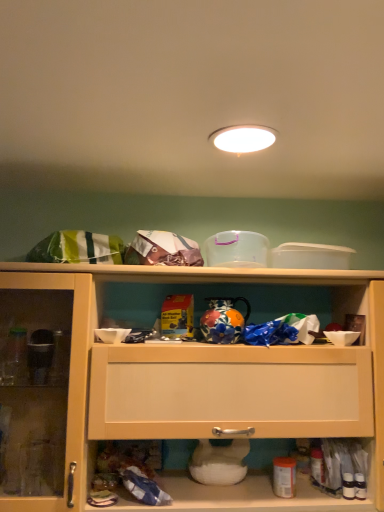
I want to click on matte wood cabinet at center, so click(x=165, y=379).

Describe the element at coordinates (165, 379) in the screenshot. The width and height of the screenshot is (384, 512). I see `matte wood cabinet at center` at that location.

Measure the distance between matte wood cabinet at center and camera.

A distance of 1.25 meters exists between matte wood cabinet at center and camera.

You are a GUI agent. You are given a task and a screenshot of the screen. Output one action in this format:
    pyautogui.click(x=<x>, y=<y>)
    Task: Click on the white glossy light fixture at upper center
    This screenshot has width=384, height=512.
    Given the screenshot: What is the action you would take?
    pyautogui.click(x=243, y=138)

The image size is (384, 512). What do you see at coordinates (243, 138) in the screenshot?
I see `white glossy light fixture at upper center` at bounding box center [243, 138].

Where is `matte wood cabinet at center`? matte wood cabinet at center is located at coordinates (165, 379).

Does white glossy light fixture at upper center appear on the right side of matte wood cabinet at center?

Correct, you'll find white glossy light fixture at upper center to the right of matte wood cabinet at center.

Relative to matte wood cabinet at center, is white glossy light fixture at upper center in front or behind?

In the image, white glossy light fixture at upper center appears in front of matte wood cabinet at center.

Is point (243, 131) positioned behind point (206, 356)?

No, it is in front of (206, 356).

From the image's perspective, between white glossy light fixture at upper center and matte wood cabinet at center, who is located below?

matte wood cabinet at center, from the image's perspective.

From a real-world perspective, who is located higher, white glossy light fixture at upper center or matte wood cabinet at center?

white glossy light fixture at upper center, from a real-world perspective.

Which object is wider, white glossy light fixture at upper center or matte wood cabinet at center?

Wider between the two is matte wood cabinet at center.

Does white glossy light fixture at upper center have a greater height compared to matte wood cabinet at center?

No, white glossy light fixture at upper center is not taller than matte wood cabinet at center.

Which of these two, white glossy light fixture at upper center or matte wood cabinet at center, is smaller?

With smaller size is white glossy light fixture at upper center.

Is white glossy light fixture at upper center outside of matte wood cabinet at center?

Indeed, white glossy light fixture at upper center is completely outside matte wood cabinet at center.

Is white glossy light fixture at upper center in contact with matte wood cabinet at center?

They are not placed beside each other.

Does white glossy light fixture at upper center turn towards matte wood cabinet at center?

No, white glossy light fixture at upper center does not turn towards matte wood cabinet at center.

Can you tell me how much white glossy light fixture at upper center and matte wood cabinet at center differ in facing direction?

89.2 degrees.

How distant is white glossy light fixture at upper center from matte wood cabinet at center?

white glossy light fixture at upper center and matte wood cabinet at center are 77.05 centimeters apart from each other.

Identify the location of lighting that is in front of the matte wood cabinet at center. This screenshot has height=512, width=384. (243, 138).

Is matte wood cabinet at center at the right side of white glossy light fixture at upper center?

No, matte wood cabinet at center is not to the right of white glossy light fixture at upper center.

In the image, is matte wood cabinet at center positioned in front of or behind white glossy light fixture at upper center?

Visually, matte wood cabinet at center is located behind white glossy light fixture at upper center.

Which is behind, point (45, 284) or point (259, 131)?

The point (45, 284) is farther.

From the image's perspective, is matte wood cabinet at center located above or below white glossy light fixture at upper center?

Based on their image positions, matte wood cabinet at center is located beneath white glossy light fixture at upper center.

From a real-world perspective, is matte wood cabinet at center below white glossy light fixture at upper center?

Yes, from a real-world perspective, matte wood cabinet at center is below white glossy light fixture at upper center.

Considering the relative sizes of matte wood cabinet at center and white glossy light fixture at upper center in the image provided, is matte wood cabinet at center thinner than white glossy light fixture at upper center?

Incorrect, the width of matte wood cabinet at center is not less than that of white glossy light fixture at upper center.

Who is shorter, matte wood cabinet at center or white glossy light fixture at upper center?

With less height is white glossy light fixture at upper center.

Looking at the image, does matte wood cabinet at center seem bigger or smaller compared to white glossy light fixture at upper center?

matte wood cabinet at center is bigger than white glossy light fixture at upper center.

Is matte wood cabinet at center inside or outside of white glossy light fixture at upper center?

matte wood cabinet at center is outside white glossy light fixture at upper center.

Is there a large distance between matte wood cabinet at center and white glossy light fixture at upper center?

Actually, matte wood cabinet at center and white glossy light fixture at upper center are a little close together.

Is matte wood cabinet at center aimed at white glossy light fixture at upper center?

No, matte wood cabinet at center is not facing towards white glossy light fixture at upper center.

What's the angular difference between matte wood cabinet at center and white glossy light fixture at upper center's facing directions?

The angular difference between matte wood cabinet at center and white glossy light fixture at upper center is 89.2 degrees.

How much distance is there between matte wood cabinet at center and white glossy light fixture at upper center?

matte wood cabinet at center and white glossy light fixture at upper center are 30.33 inches apart.

Find the location of `lighting lying above the matte wood cabinet at center (from the image's perspective)`. lighting lying above the matte wood cabinet at center (from the image's perspective) is located at coordinates 243,138.

At what (x,y) coordinates should I click in order to perform the action: click on cabinetry below the white glossy light fixture at upper center (from the image's perspective). Please return your answer as a coordinate pair (x, y). Image resolution: width=384 pixels, height=512 pixels. Looking at the image, I should click on (165, 379).

I want to click on lighting on the right of matte wood cabinet at center, so click(x=243, y=138).